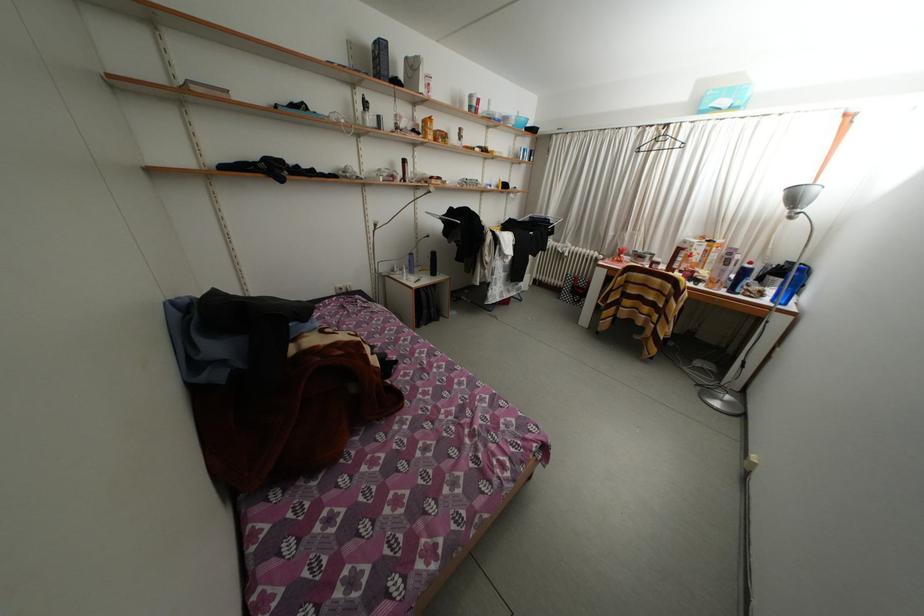
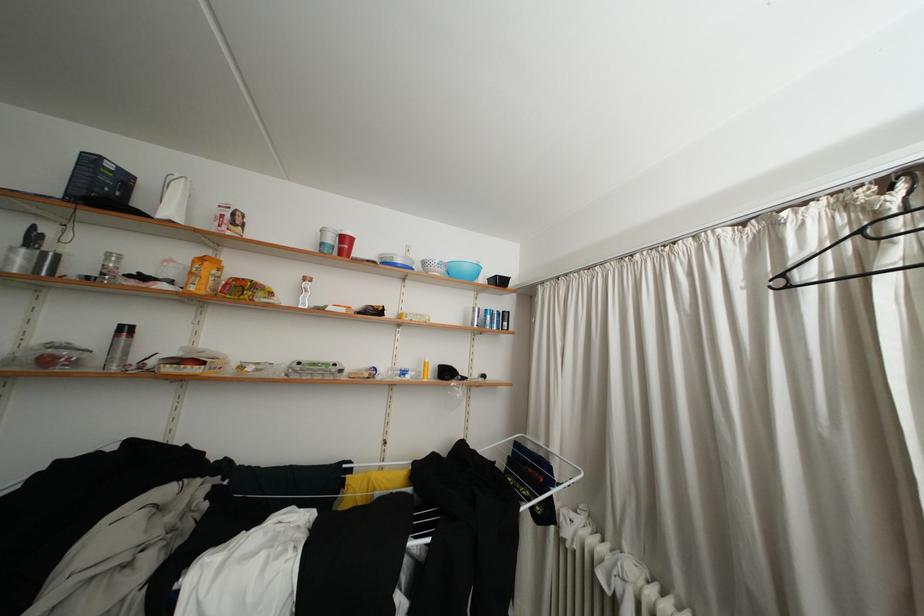
Locate, in the second image, the point that corresponds to point (371, 124) in the first image.

(17, 264)